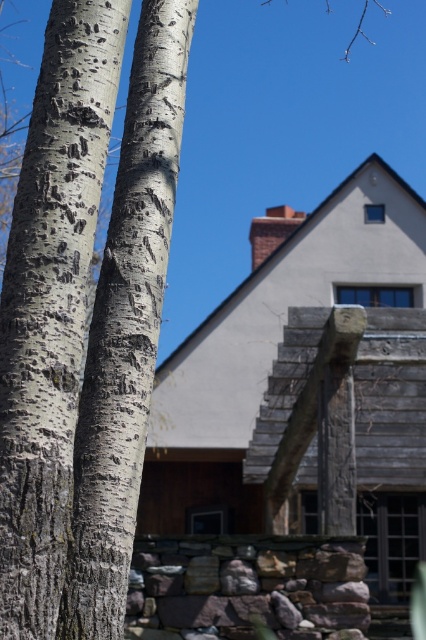
You are an artist sketching the scene and want to draw the white textured bark at left and the white bark tree trunk at left accurately. Which one should you draw first if you follow the standard drawing technique of starting with objects closer to the viewer?

The white textured bark at left should be drawn first because it is positioned over the white bark tree trunk at left, indicating it is closer to the viewer.

You are standing in the outdoor scene and want to touch the white textured bark at left. Based on its coordinates, where should you move your hand to reach it?

The white textured bark at left is located at coordinates point (51, 304), so move your hand to that position to reach it.